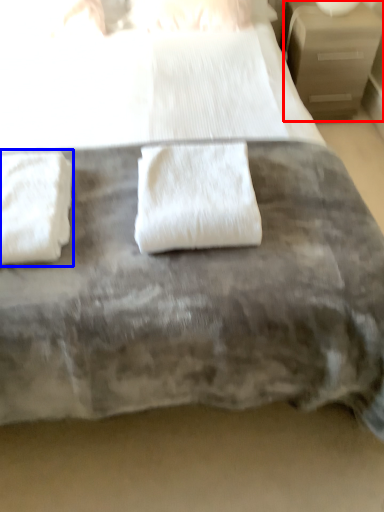
Question: Which object appears closest to the camera in this image, nightstand (highlighted by a red box) or towel (highlighted by a blue box)?

Choices:
 (A) nightstand
 (B) towel

Answer: (B)